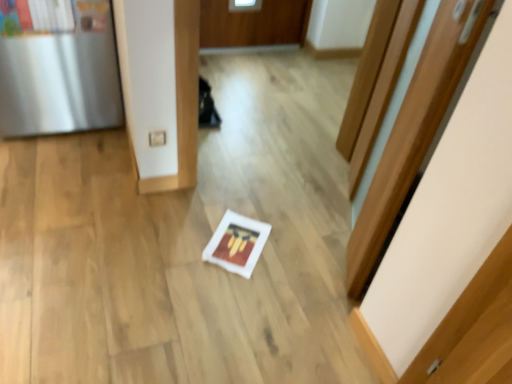
Question: In the image, is white matte frame at center on the left side or the right side of satin silver fridge at left?

Choices:
 (A) right
 (B) left

Answer: (A)

Question: Based on their sizes in the image, would you say white matte frame at center is bigger or smaller than satin silver fridge at left?

Choices:
 (A) big
 (B) small

Answer: (B)

Question: Considering the real-world distances, which object is farthest from the wooden door at center?

Choices:
 (A) white matte frame at center
 (B) satin silver fridge at left

Answer: (B)

Question: Considering the real-world distances, which object is closest to the wooden door at center?

Choices:
 (A) satin silver fridge at left
 (B) white matte frame at center

Answer: (B)